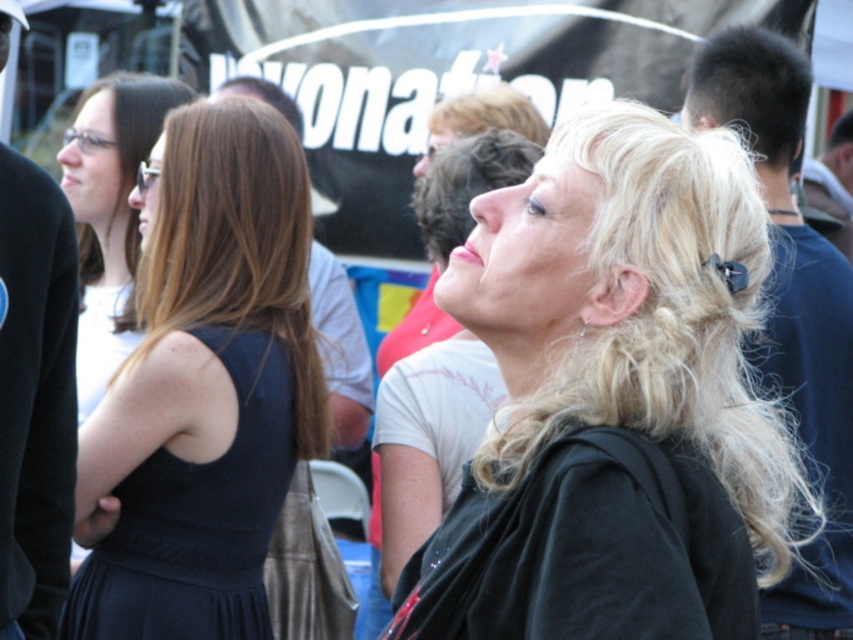
Question: Is blonde hair at center bigger than black fabric dress at left?

Choices:
 (A) no
 (B) yes

Answer: (A)

Question: Which object appears farthest from the camera in this image?

Choices:
 (A) black fabric dress at left
 (B) black hair at upper right
 (C) matte black shirt at center
 (D) dark blue fabric dress at left

Answer: (C)

Question: Which object is positioned closest to the black hair at upper right?

Choices:
 (A) brown straight hair at upper left
 (B) black fabric dress at left

Answer: (B)

Question: Which of the following is the farthest from the observer?

Choices:
 (A) blonde hair at center
 (B) black fabric dress at left
 (C) curly blonde hair at upper center

Answer: (C)

Question: Does black fabric jacket at upper left lie in front of blonde hair at upper center?

Choices:
 (A) yes
 (B) no

Answer: (A)

Question: Does black fabric jacket at upper left have a smaller size compared to blonde hair at upper right?

Choices:
 (A) yes
 (B) no

Answer: (A)